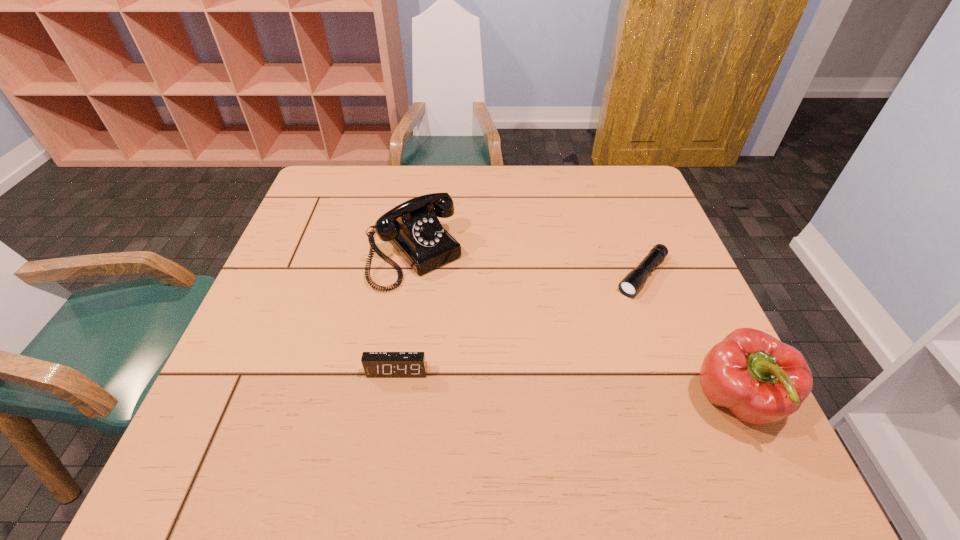
This screenshot has width=960, height=540. Find the location of `free space on the desktop that is between the second shortest object and the pepper and is positioned on the dial of the telephone`. free space on the desktop that is between the second shortest object and the pepper and is positioned on the dial of the telephone is located at coordinates (529, 383).

In order to click on free spot on the desktop that is between the second shortest object and the pepper and is positioned at the lens end of the flashlight in this screenshot , I will do `click(548, 385)`.